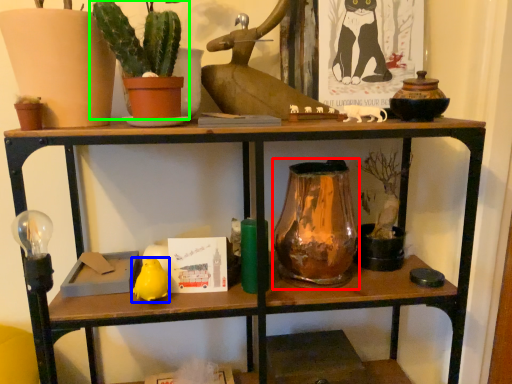
Question: Which is farther away from glass vase (highlighted by a red box)? animal (highlighted by a blue box) or houseplant (highlighted by a green box)?

Choices:
 (A) animal
 (B) houseplant

Answer: (B)